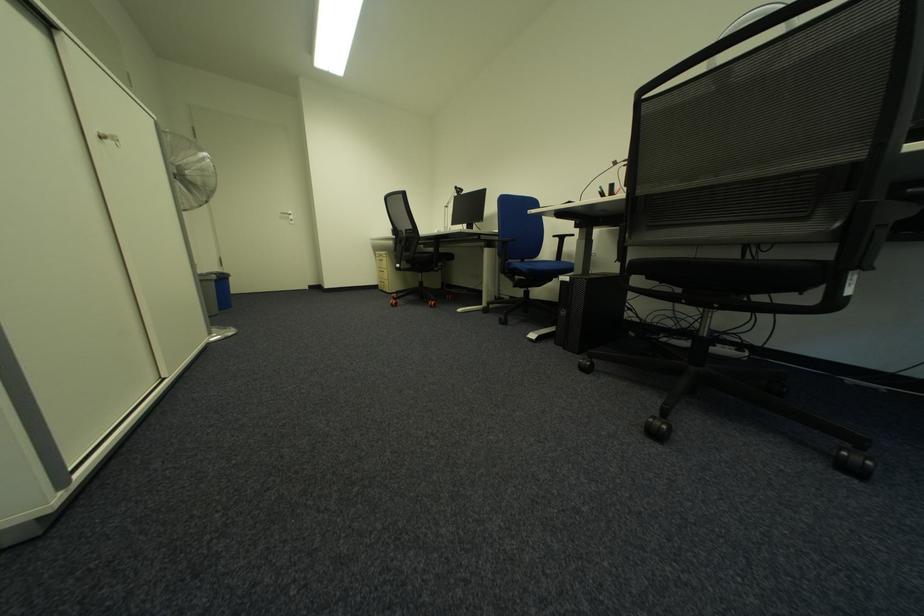
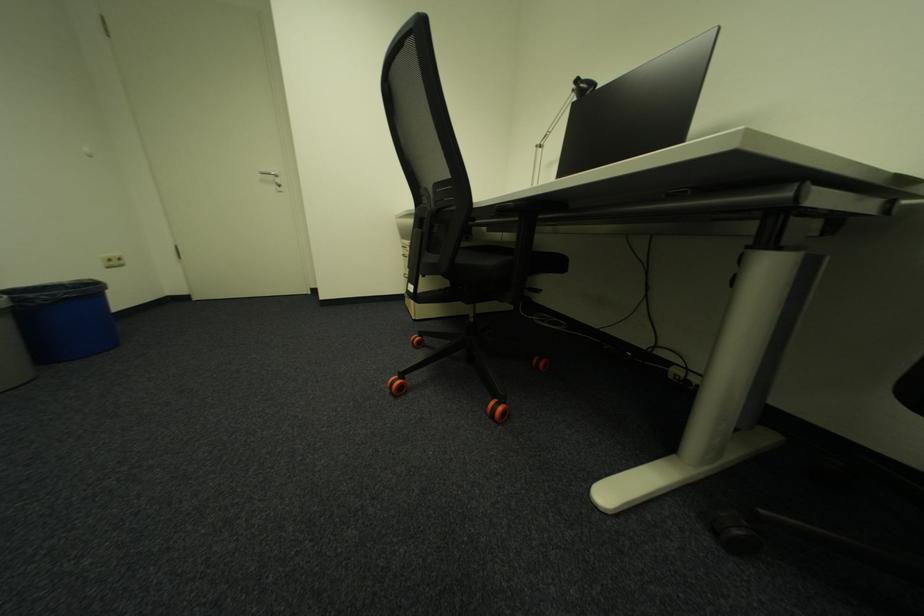
Question: Which direction would the cameraman need to move to produce the second image? Reply with the corresponding letter.

Choices:
 (A) Left
 (B) Right
 (C) Forward
 (D) Backward

Answer: (C)